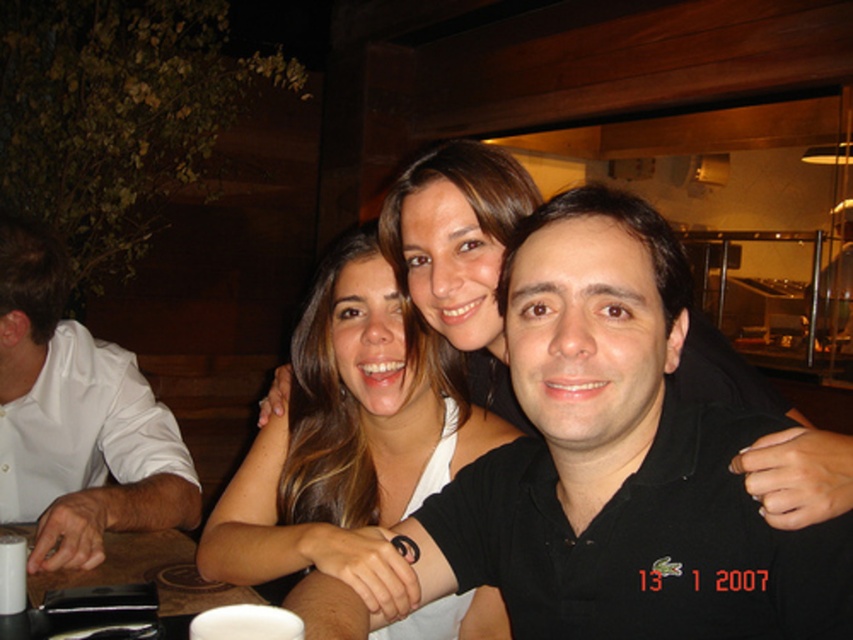
Question: Can you confirm if smooth white tank top at center is wider than white matte cup at lower center?

Choices:
 (A) no
 (B) yes

Answer: (B)

Question: Which point is farther from the camera taking this photo?

Choices:
 (A) (722, 630)
 (B) (265, 465)
 (C) (233, 632)
 (D) (151, 545)

Answer: (D)

Question: Is white glossy cup at left smaller than white matte cup at lower center?

Choices:
 (A) yes
 (B) no

Answer: (B)

Question: Can you confirm if smooth white tank top at center is positioned to the right of white glossy cup at left?

Choices:
 (A) yes
 (B) no

Answer: (A)

Question: Which object appears closest to the camera in this image?

Choices:
 (A) white matte cup at lower center
 (B) smooth white tank top at center

Answer: (A)

Question: Which point appears farthest from the camera in this image?

Choices:
 (A) (236, 605)
 (B) (515, 528)
 (C) (22, 429)
 (D) (280, 477)

Answer: (C)